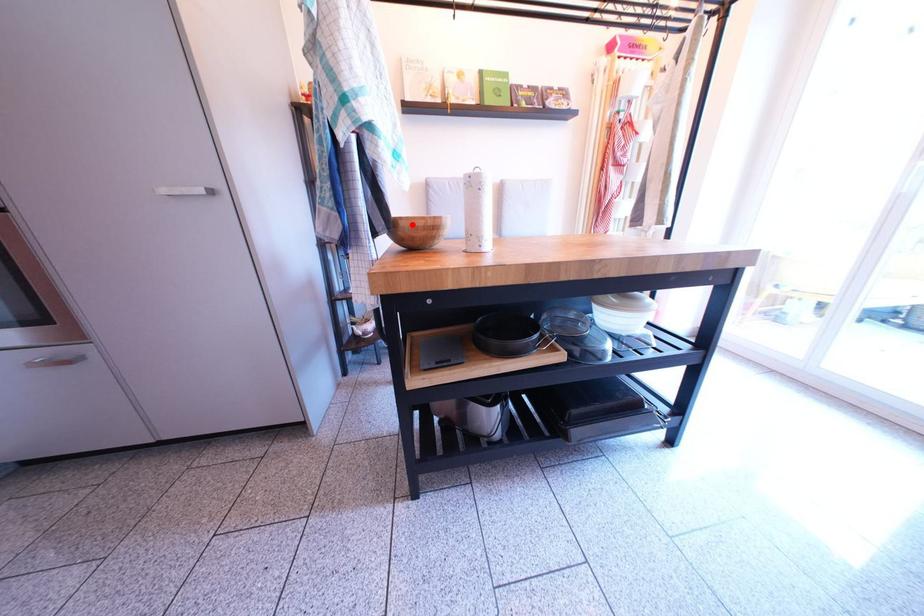
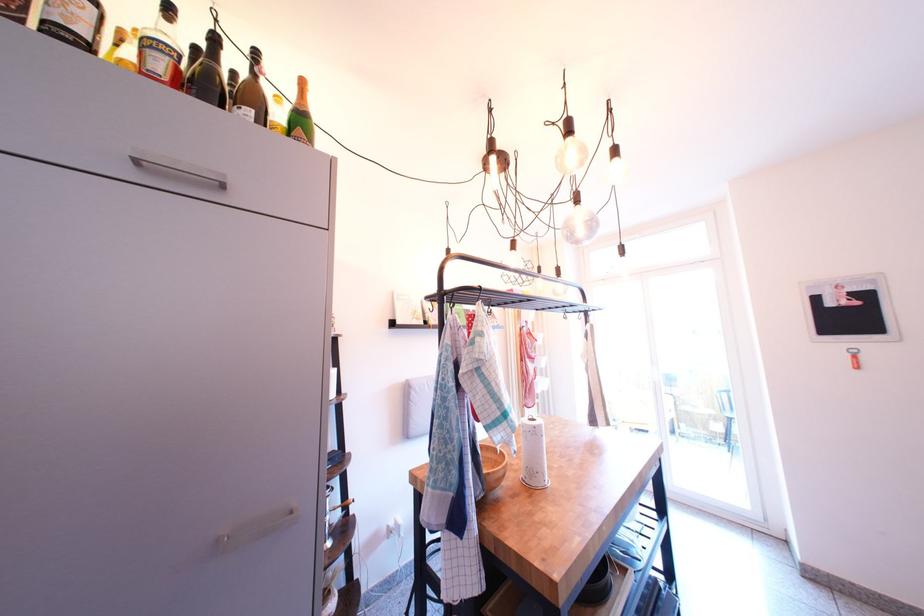
The point at the highlighted location is marked in the first image. Where is the corresponding point in the second image?

(500, 480)